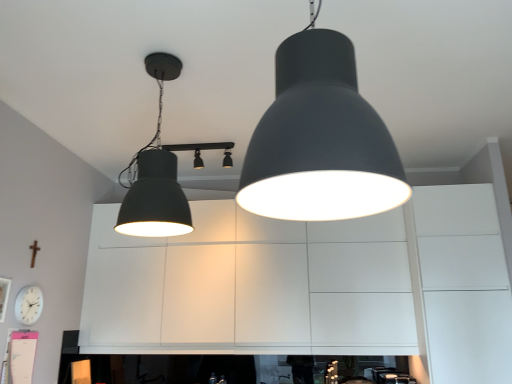
Question: Is matte black lampshade at center, the 3th lamp in the back-to-front sequence, bigger than matte black spotlights at center, marked as the first lamp in a back-to-front arrangement?

Choices:
 (A) yes
 (B) no

Answer: (A)

Question: From a real-world perspective, does matte black lampshade at center, the 1th lamp from the front, sit lower than matte black spotlights at center, acting as the 3th lamp starting from the front?

Choices:
 (A) no
 (B) yes

Answer: (B)

Question: Is matte black lampshade at center, the 1th lamp from the front, positioned before matte black spotlights at center, acting as the 3th lamp starting from the front?

Choices:
 (A) no
 (B) yes

Answer: (B)

Question: Is matte black lampshade at center, the 3th lamp in the back-to-front sequence, positioned behind matte black spotlights at center, marked as the first lamp in a back-to-front arrangement?

Choices:
 (A) yes
 (B) no

Answer: (B)

Question: Is matte black lampshade at center, the 1th lamp from the front, shorter than matte black spotlights at center, acting as the 3th lamp starting from the front?

Choices:
 (A) yes
 (B) no

Answer: (B)

Question: Does matte black lampshade at center, the 1th lamp from the front, have a greater width compared to matte black spotlights at center, acting as the 3th lamp starting from the front?

Choices:
 (A) yes
 (B) no

Answer: (B)

Question: From a real-world perspective, is matte black lampshade at center, the 1th lamp from the front, on top of white matte clock at lower left?

Choices:
 (A) yes
 (B) no

Answer: (A)

Question: Considering the relative sizes of matte black lampshade at center, the 1th lamp from the front, and white matte clock at lower left in the image provided, is matte black lampshade at center, the 1th lamp from the front, wider than white matte clock at lower left?

Choices:
 (A) yes
 (B) no

Answer: (A)

Question: Would you say matte black lampshade at center, the 1th lamp from the front, is outside white matte clock at lower left?

Choices:
 (A) no
 (B) yes

Answer: (B)

Question: Considering the relative sizes of matte black lampshade at center, the 3th lamp in the back-to-front sequence, and white matte clock at lower left in the image provided, is matte black lampshade at center, the 3th lamp in the back-to-front sequence, taller than white matte clock at lower left?

Choices:
 (A) yes
 (B) no

Answer: (A)

Question: Is white matte clock at lower left a part of matte black lampshade at center, the 1th lamp from the front?

Choices:
 (A) yes
 (B) no

Answer: (B)

Question: Is matte black lampshade at center, the 1th lamp from the front, to the right of white matte clock at lower left from the viewer's perspective?

Choices:
 (A) yes
 (B) no

Answer: (A)

Question: Is white matte clock at lower left thinner than matte black lampshade at center, the 1th lamp from the front?

Choices:
 (A) yes
 (B) no

Answer: (A)